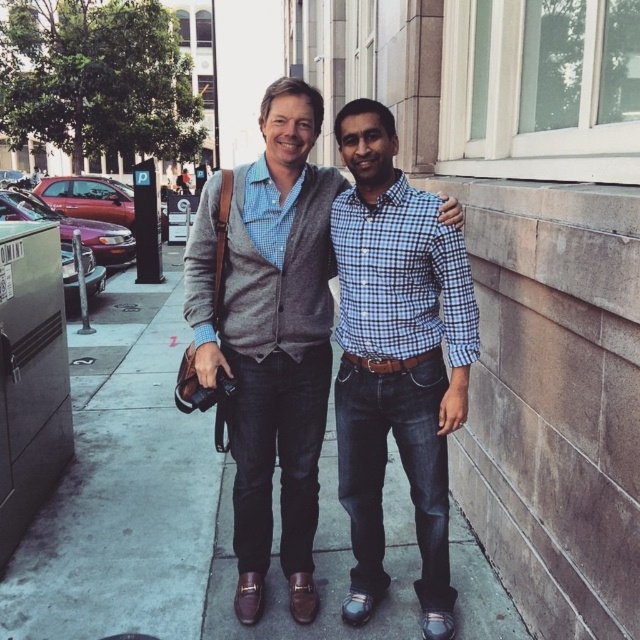
You are a photographer trying to capture a candid shot of the two people on the sidewalk. You want to ensure that the matte gray sweater at center and the blue checkered shirt at center are both in focus. Since you can only focus on one subject at a time, which person should you focus on first to ensure the other is also in focus?

You should focus on the matte gray sweater at center first because it is positioned to the left of the blue checkered shirt at center, so adjusting focus from left to right will keep both in focus.

You are a delivery person trying to navigate between two points on the sidewalk. The first point is at coordinates point (262, 188) and the second point is at point (365, 214). Which point is closer to the parked red car?

The question cannot be answered with the provided information because the spatial relationship between the points and the parked red car is not described in the Objects Description.